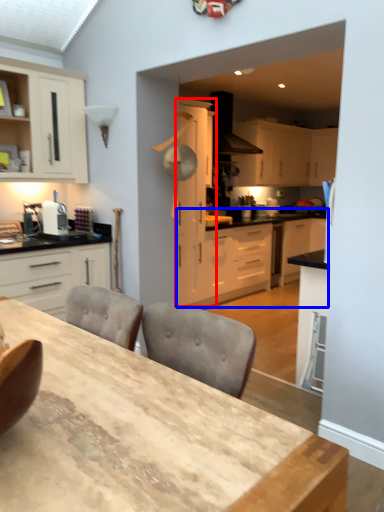
Question: Which of the following is the farthest to the observer, cabinetry (highlighted by a red box) or counter (highlighted by a blue box)?

Choices:
 (A) cabinetry
 (B) counter

Answer: (B)